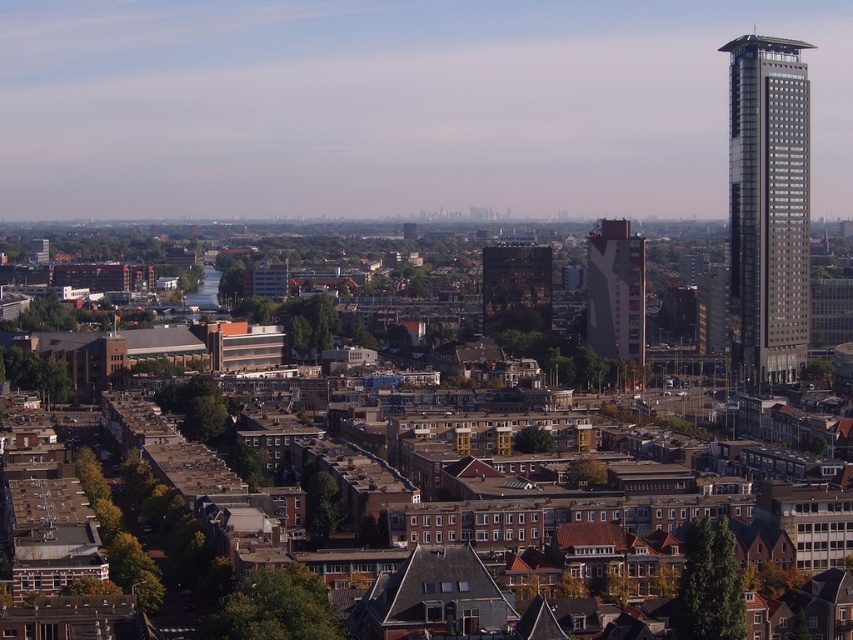
Between point (608, 269) and point (490, 252), which one is positioned in front?

Point (608, 269) is more forward.

Who is positioned more to the right, red brick building at center or dark brown brick building at center?

red brick building at center

Between point (628, 321) and point (509, 278), which one is positioned behind?

Point (509, 278)

Where is `red brick building at center`? Image resolution: width=853 pixels, height=640 pixels. red brick building at center is located at coordinates (614, 291).

Which is above, silver metallic skyscraper at right or dark brown brick building at center?

silver metallic skyscraper at right is above.

Which is in front, point (730, 307) or point (544, 294)?

Point (730, 307) is more forward.

Find the location of a particular element. The image size is (853, 640). silver metallic skyscraper at right is located at coordinates (769, 208).

Does point (738, 321) lie behind point (624, 234)?

Yes, it is behind point (624, 234).

Can you confirm if silver metallic skyscraper at right is bigger than red brick building at center?

Yes.

Between point (766, 38) and point (596, 250), which one is positioned in front?

Point (766, 38) is in front.

Identify the location of silver metallic skyscraper at right. Image resolution: width=853 pixels, height=640 pixels. (769, 208).